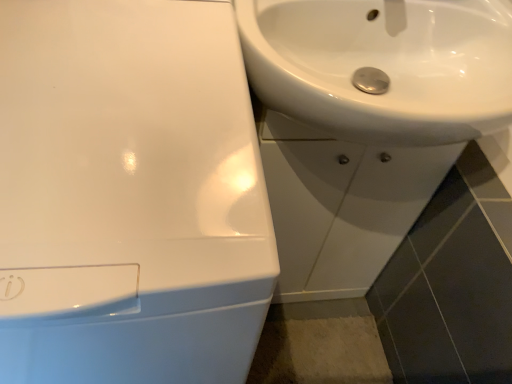
Question: Is white glossy sink at center, which ranks as the second sink in left-to-right order, in front of or behind white glossy sink at upper right, which appears as the third sink when viewed from the left, in the image?

Choices:
 (A) front
 (B) behind

Answer: (B)

Question: Would you say white glossy sink at center, which appears as the 2th sink when viewed from the right, is inside or outside white glossy sink at upper right, which appears as the third sink when viewed from the left?

Choices:
 (A) inside
 (B) outside

Answer: (B)

Question: Which object is positioned farthest from the white glossy sink at upper right, acting as the third sink starting from the right?

Choices:
 (A) white glossy sink at center, which ranks as the second sink in left-to-right order
 (B) white glossy sink at upper right, which appears as the third sink when viewed from the left

Answer: (A)

Question: Estimate the real-world distances between objects in this image. Which object is farther from the white glossy sink at upper right, which appears as the third sink when viewed from the left?

Choices:
 (A) white glossy sink at center, which appears as the 2th sink when viewed from the right
 (B) white glossy sink at upper right, marked as the 1th sink in a left-to-right arrangement

Answer: (B)